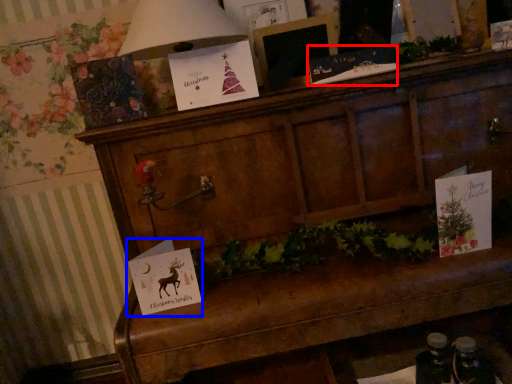
Question: Among these objects, which one is nearest to the camera, christmas card (highlighted by a red box) or christmas card (highlighted by a blue box)?

Choices:
 (A) christmas card
 (B) christmas card

Answer: (B)